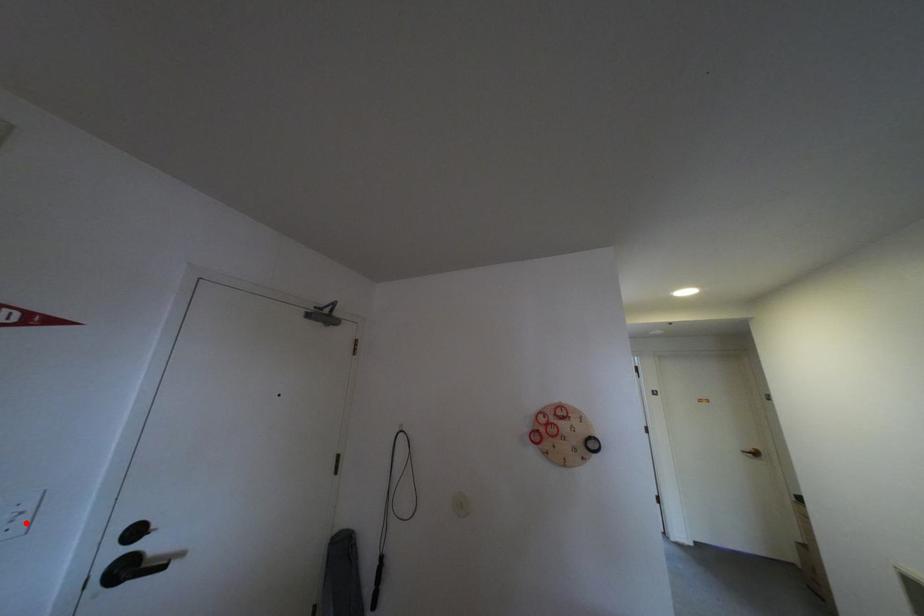
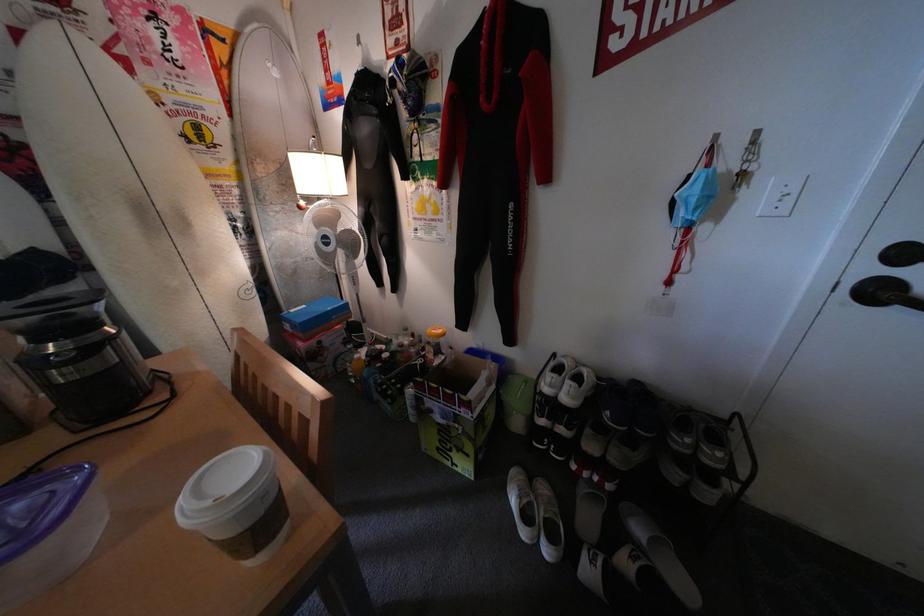
Locate, in the second image, the point that corresponds to the highlighted location in the first image.

(795, 201)